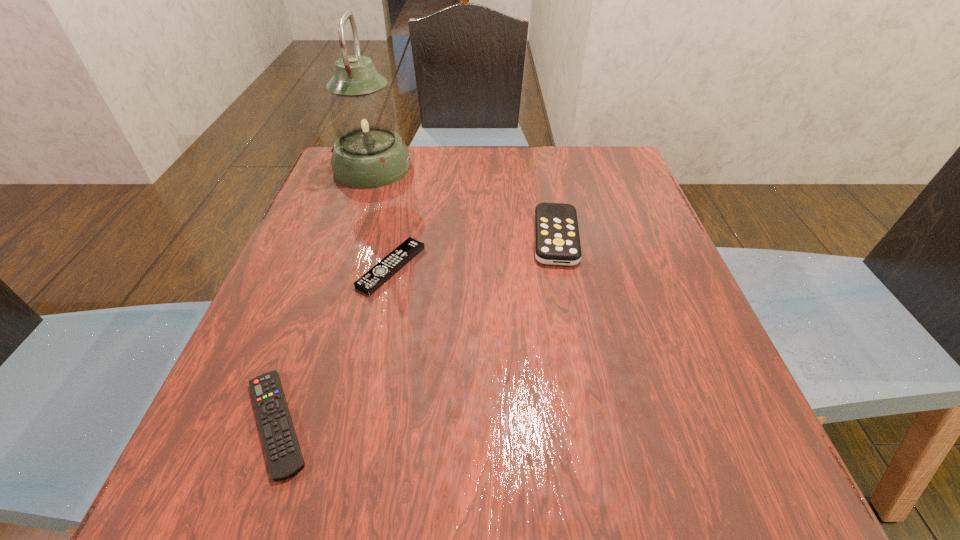
Locate an element on the screen. free space between the lantern and the nearest remote control is located at coordinates (324, 295).

Locate an element on the screen. vacant area that lies between the lantern and the nearest object is located at coordinates (324, 295).

Where is `the third closest object to the nearest remote control`? the third closest object to the nearest remote control is located at coordinates (368, 153).

This screenshot has height=540, width=960. Find the location of `object that is the closest to the tallest object`. object that is the closest to the tallest object is located at coordinates (371, 281).

You are a GUI agent. You are given a task and a screenshot of the screen. Output one action in this format:
    pyautogui.click(x=<x>, y=<y>)
    Task: Click on the second closest remote control to the nearest remote control
    This screenshot has width=960, height=540.
    Given the screenshot: What is the action you would take?
    pyautogui.click(x=557, y=242)

You are a GUI agent. You are given a task and a screenshot of the screen. Output one action in this format:
    pyautogui.click(x=<x>, y=<y>)
    Task: Click on the remote control that can be found as the closest to the tallest object
    This screenshot has height=540, width=960.
    Given the screenshot: What is the action you would take?
    pyautogui.click(x=371, y=281)

Locate an element on the screen. vacant space that satisfies the following two spatial constraints: 1. on the back side of the nearest remote control; 2. on the left side of the third shortest object is located at coordinates (342, 237).

Find the location of a particular element. The width and height of the screenshot is (960, 540). free space that satisfies the following two spatial constraints: 1. on the back side of the nearest remote control; 2. on the left side of the farthest object is located at coordinates (367, 167).

Where is `free spot that satisfies the following two spatial constraints: 1. on the front side of the rightmost object; 2. on the right side of the farthest object`? free spot that satisfies the following two spatial constraints: 1. on the front side of the rightmost object; 2. on the right side of the farthest object is located at coordinates (349, 237).